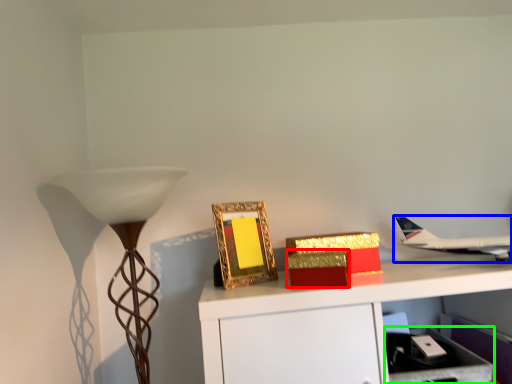
Question: Which object is positioned farthest from cardboard box (highlighted by a red box)? Select from airplane (highlighted by a blue box) and drawer (highlighted by a green box).

Choices:
 (A) airplane
 (B) drawer

Answer: (A)